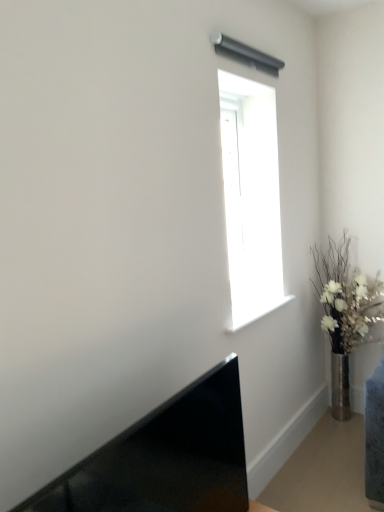
Question: In the image, is silver metallic vase at right positioned in front of or behind transparent glass window at upper center?

Choices:
 (A) behind
 (B) front

Answer: (A)

Question: From a real-world perspective, is silver metallic vase at right positioned above or below transparent glass window at upper center?

Choices:
 (A) above
 (B) below

Answer: (B)

Question: Estimate the real-world distances between objects in this image. Which object is farther from the transparent glass window at upper center?

Choices:
 (A) matte black laptop at lower left
 (B) silver metallic vase at right

Answer: (A)

Question: Estimate the real-world distances between objects in this image. Which object is farther from the transparent glass window at upper center?

Choices:
 (A) silver metallic vase at right
 (B) matte black laptop at lower left

Answer: (B)